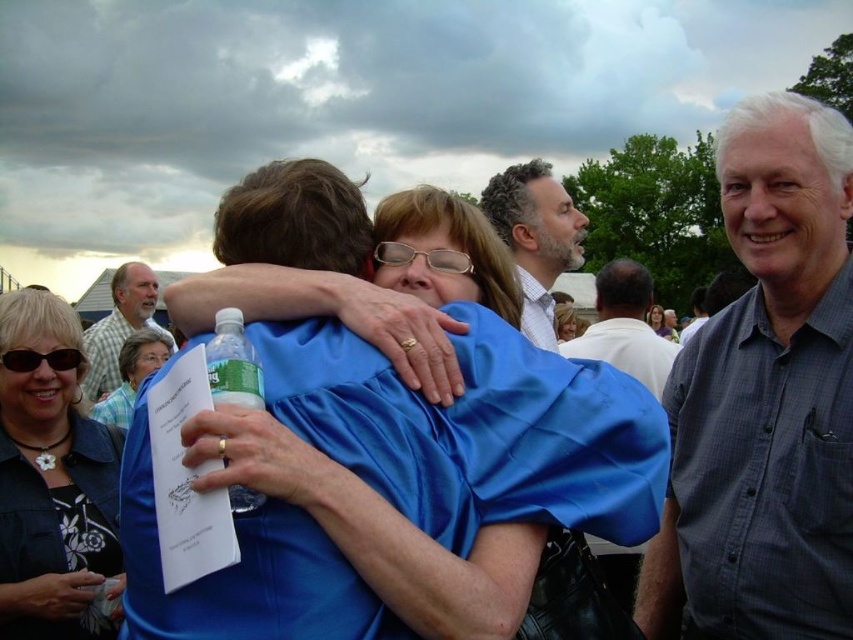
Does blue satin shirt at center have a lesser height compared to clear plastic bottle at center?

No.

Does blue satin shirt at center come behind clear plastic bottle at center?

No, blue satin shirt at center is closer to the viewer.

Where is `blue satin shirt at center`? blue satin shirt at center is located at coordinates tap(375, 529).

Where is `gray checkered shirt at right`? This screenshot has width=853, height=640. gray checkered shirt at right is located at coordinates (764, 400).

Is gray checkered shirt at right to the left of plaid cotton shirt at left from the viewer's perspective?

No, gray checkered shirt at right is not to the left of plaid cotton shirt at left.

At what (x,y) coordinates should I click in order to perform the action: click on gray checkered shirt at right. Please return your answer as a coordinate pair (x, y). This screenshot has height=640, width=853. Looking at the image, I should click on (764, 400).

Where is `gray checkered shirt at right`? The width and height of the screenshot is (853, 640). gray checkered shirt at right is located at coordinates (764, 400).

What do you see at coordinates (625, 326) in the screenshot?
I see `white shirt at upper center` at bounding box center [625, 326].

Does white shirt at upper center lie in front of clear plastic bottle at center?

No, white shirt at upper center is behind clear plastic bottle at center.

Is point (636, 307) positioned before point (229, 358)?

No.

You are a GUI agent. You are given a task and a screenshot of the screen. Output one action in this format:
    pyautogui.click(x=<x>, y=<y>)
    Task: Click on the white shirt at upper center
    
    Given the screenshot: What is the action you would take?
    pyautogui.click(x=625, y=326)